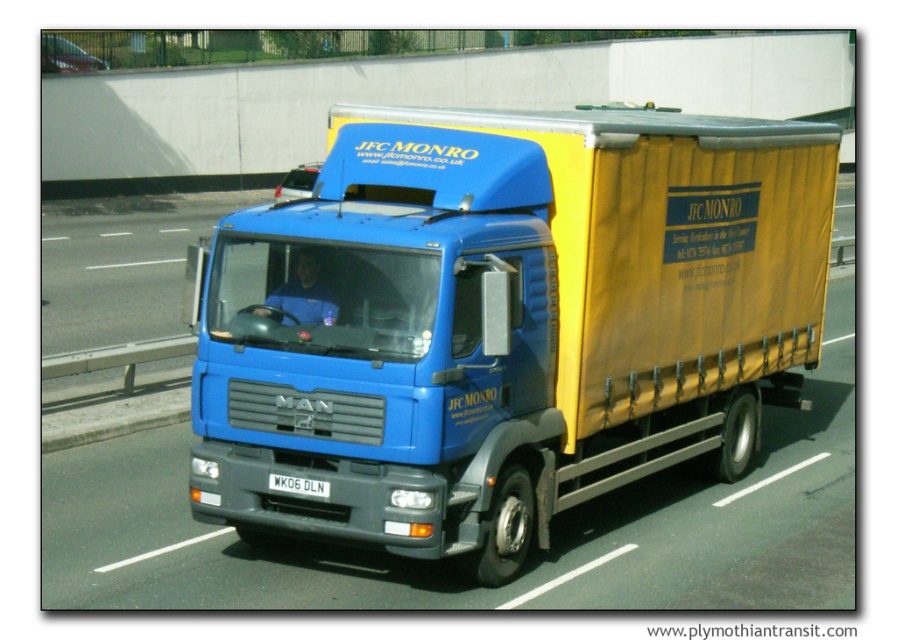
Question: Is blue matte truck at center to the right of white plastic license plate at center from the viewer's perspective?

Choices:
 (A) yes
 (B) no

Answer: (A)

Question: Which point appears farthest from the camera in this image?

Choices:
 (A) (298, 486)
 (B) (730, 163)

Answer: (B)

Question: Which object is farther from the camera taking this photo?

Choices:
 (A) white plastic license plate at center
 (B) blue matte truck at center

Answer: (B)

Question: Considering the relative positions of blue matte truck at center and white plastic license plate at center in the image provided, where is blue matte truck at center located with respect to white plastic license plate at center?

Choices:
 (A) below
 (B) above

Answer: (B)

Question: Does blue matte truck at center have a lesser width compared to white plastic license plate at center?

Choices:
 (A) yes
 (B) no

Answer: (A)